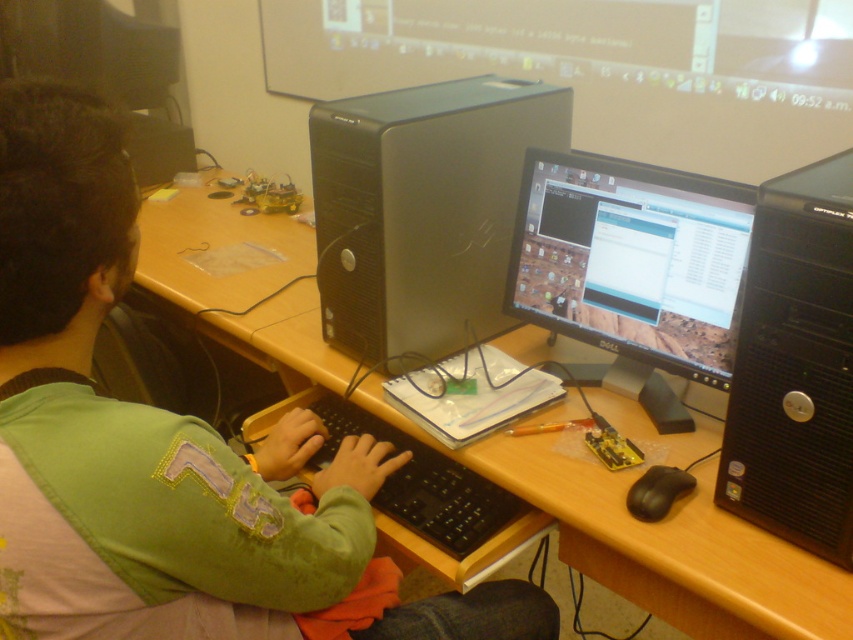
Does wooden at center have a larger size compared to black plastic tower at right?

Yes, wooden at center is bigger than black plastic tower at right.

Consider the image. Is wooden at center positioned before black plastic tower at right?

No, it is behind black plastic tower at right.

The width and height of the screenshot is (853, 640). I want to click on wooden at center, so click(659, 541).

Who is shorter, green fabric shirt at center or matte black monitor at center?

matte black monitor at center is shorter.

Is the position of green fabric shirt at center less distant than that of matte black monitor at center?

Yes, green fabric shirt at center is in front of matte black monitor at center.

Is point (337, 554) positioned in front of point (686, 355)?

Yes, it is in front of point (686, 355).

At what (x,y) coordinates should I click in order to perform the action: click on green fabric shirt at center. Please return your answer as a coordinate pair (x, y). Looking at the image, I should click on click(161, 445).

Does point (463, 337) lie behind point (727, 189)?

Yes, it is.

Is satin black tower at center below matte black monitor at center?

No, satin black tower at center is not below matte black monitor at center.

Between point (376, 104) and point (619, 369), which one is positioned behind?

The point (619, 369) is behind.

This screenshot has width=853, height=640. I want to click on satin black tower at center, so click(422, 211).